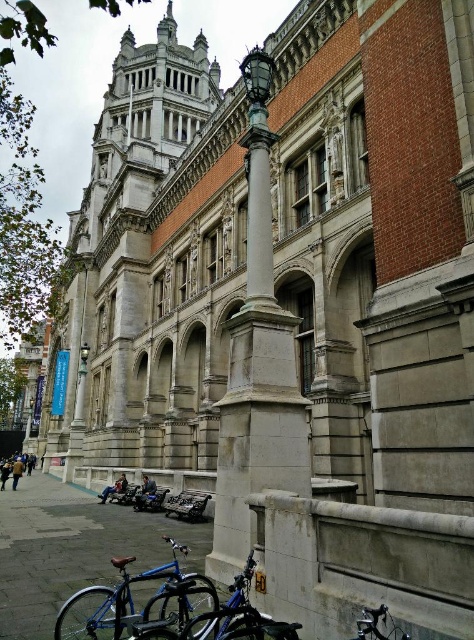
Does smooth concrete pavement at lower left appear on the right side of blue metallic bicycle at lower left?

No, smooth concrete pavement at lower left is not to the right of blue metallic bicycle at lower left.

Between point (11, 550) and point (208, 624), which one is positioned in front?

Point (208, 624)

This screenshot has width=474, height=640. Find the location of `smooth concrete pavement at lower left`. smooth concrete pavement at lower left is located at coordinates (72, 548).

Between point (269, 163) and point (9, 483), which one is positioned behind?

The point (9, 483) is more distant.

Can you confirm if slate gray stone column at center is positioned above smooth concrete pavement at lower left?

Indeed, slate gray stone column at center is positioned over smooth concrete pavement at lower left.

Does point (300, 451) come in front of point (54, 500)?

Yes, it is in front of point (54, 500).

Find the location of `slate gray stone column at center`. slate gray stone column at center is located at coordinates (256, 378).

What do you see at coordinates (256, 378) in the screenshot? The image size is (474, 640). I see `slate gray stone column at center` at bounding box center [256, 378].

Does slate gray stone column at center have a greater height compared to blue matte bicycle at lower left?

Yes, slate gray stone column at center is taller than blue matte bicycle at lower left.

The image size is (474, 640). What are the coordinates of `slate gray stone column at center` in the screenshot? It's located at (256, 378).